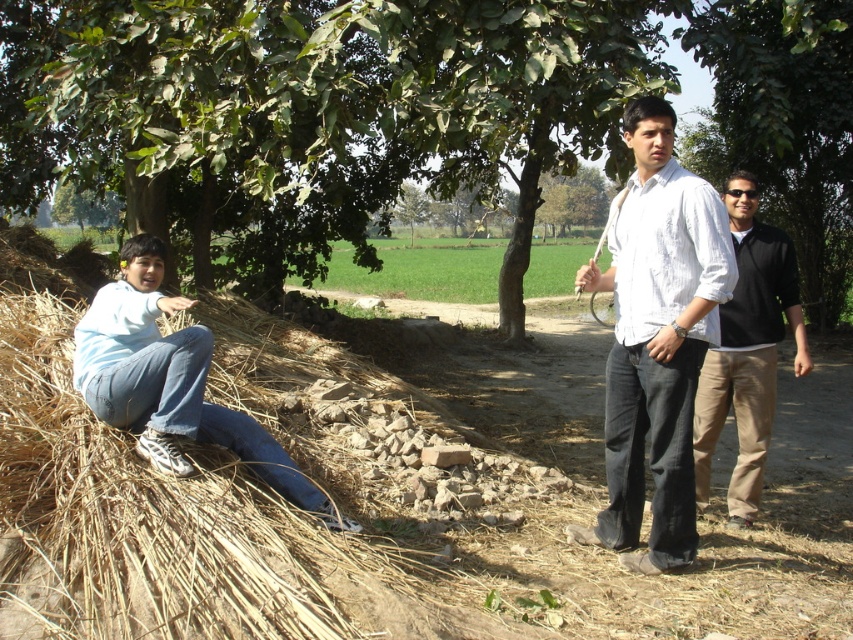
You are standing in the rural scene and want to walk from the green leafy tree at upper left to the white cotton shirt at center. Which direction should you move relative to the tree?

To move from the green leafy tree at upper left to the white cotton shirt at center, you should move to the left since the white cotton shirt at center is positioned to the left of the green leafy tree at upper left according to the description.

Consider the image. You are a photographer trying to capture a clear shot of the white cotton shirt at center and the green leafy tree at upper left in the scene. However, you notice that one of these objects is blocking your view of the other. Which object is blocking the other?

The green leafy tree at upper left is blocking the view of the white cotton shirt at center because the white cotton shirt at center is behind the green leafy tree at upper left.